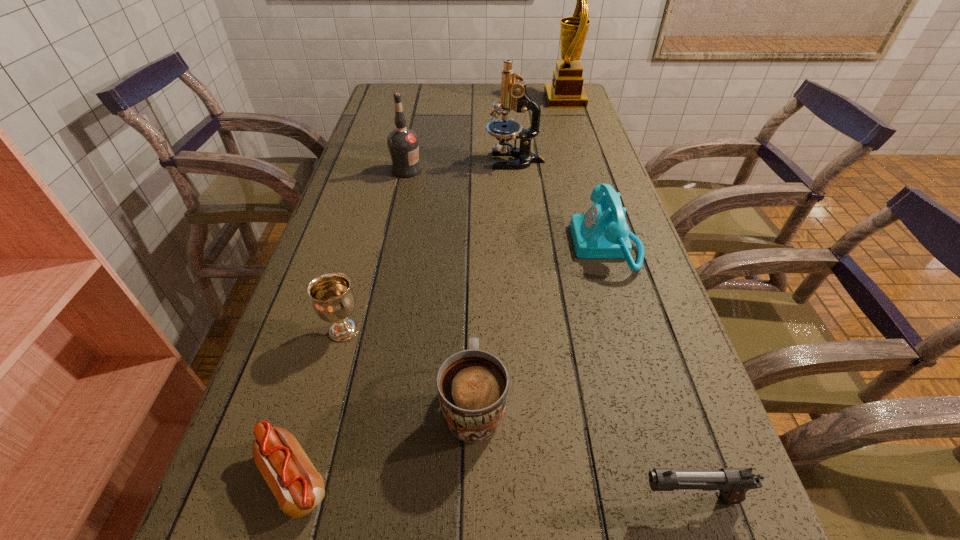
At what (x,y) coordinates should I click in order to perform the action: click on sausage present at the left edge. Please return your answer as a coordinate pair (x, y). Looking at the image, I should click on (298, 487).

You are a GUI agent. You are given a task and a screenshot of the screen. Output one action in this format:
    pyautogui.click(x=<x>, y=<y>)
    Task: Click on the award situated at the right edge
    This screenshot has width=960, height=540.
    Given the screenshot: What is the action you would take?
    pyautogui.click(x=566, y=91)

Locate an element on the screen. The image size is (960, 540). telephone located at the right edge is located at coordinates (602, 232).

At what (x,y) coordinates should I click in order to perform the action: click on gun positioned at the right edge. Please return your answer as a coordinate pair (x, y). Looking at the image, I should click on (733, 483).

This screenshot has height=540, width=960. Find the location of `object that is at the far right corner`. object that is at the far right corner is located at coordinates (566, 91).

Locate an element on the screen. The height and width of the screenshot is (540, 960). free spot at the far edge of the desktop is located at coordinates (428, 94).

Find the location of a particular element. The image size is (960, 540). vacant position at the left edge of the desktop is located at coordinates (349, 213).

Where is `vacant space at the right edge of the desktop`? This screenshot has width=960, height=540. vacant space at the right edge of the desktop is located at coordinates (692, 421).

Locate an element on the screen. The image size is (960, 540). unoccupied area between the farthest object and the chalice is located at coordinates (454, 215).

Where is `unoccupied area between the seventh shortest object and the chalice`? unoccupied area between the seventh shortest object and the chalice is located at coordinates (429, 246).